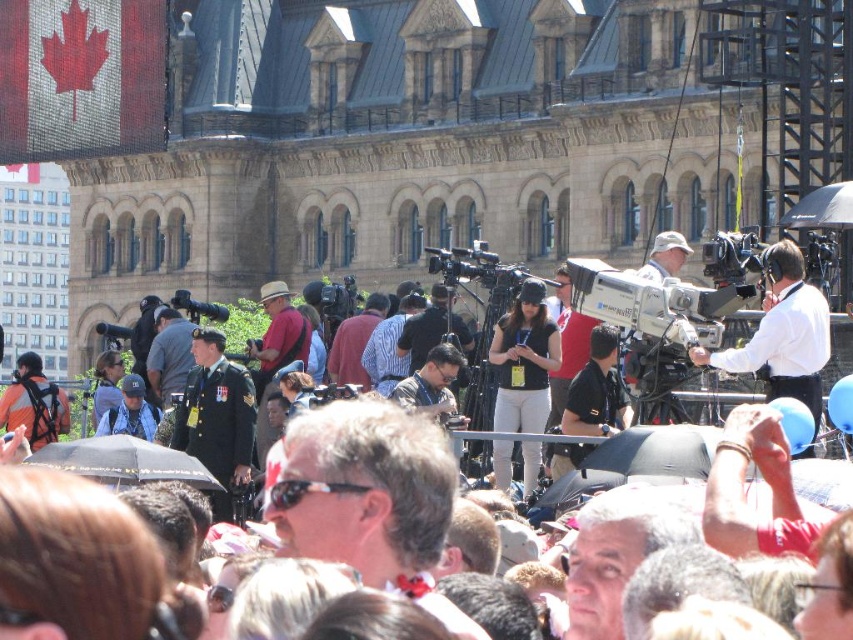
Is white cotton pants at center positioned at the back of black plastic video camera at center?

No, it is not.

Can you confirm if white cotton pants at center is positioned below black plastic video camera at center?

Incorrect, white cotton pants at center is not positioned below black plastic video camera at center.

Does point (496, 340) come behind point (224, 314)?

No, it is not.

Locate an element on the screen. This screenshot has width=853, height=640. white cotton pants at center is located at coordinates (524, 362).

Who is lower down, matte black camera at center or black plastic video camera at center?

matte black camera at center is below.

Between point (770, 496) and point (210, 310), which one is positioned in front?

Point (770, 496) is in front.

Image resolution: width=853 pixels, height=640 pixels. I want to click on matte black camera at center, so click(775, 467).

Is the position of white shirt at right less distant than that of white cotton pants at center?

Yes.

Between white shirt at right and white cotton pants at center, which one appears on the left side from the viewer's perspective?

white cotton pants at center is more to the left.

Locate an element on the screen. This screenshot has width=853, height=640. white shirt at right is located at coordinates (782, 333).